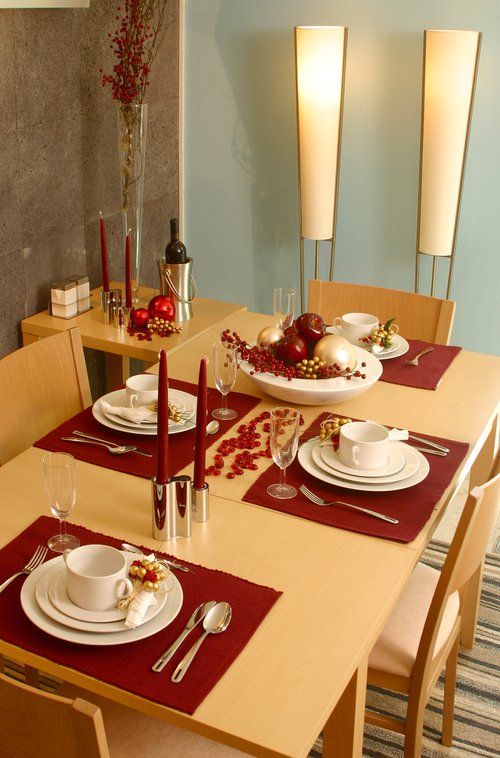
Identify the location of placemat. (166, 696), (402, 506), (406, 371), (174, 450).